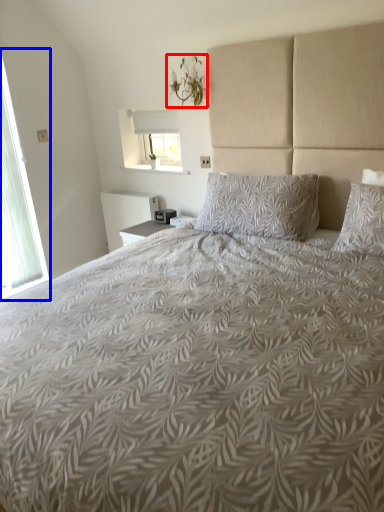
Question: Which object is closer to the camera taking this photo, light fixture (highlighted by a red box) or window (highlighted by a blue box)?

Choices:
 (A) light fixture
 (B) window

Answer: (B)